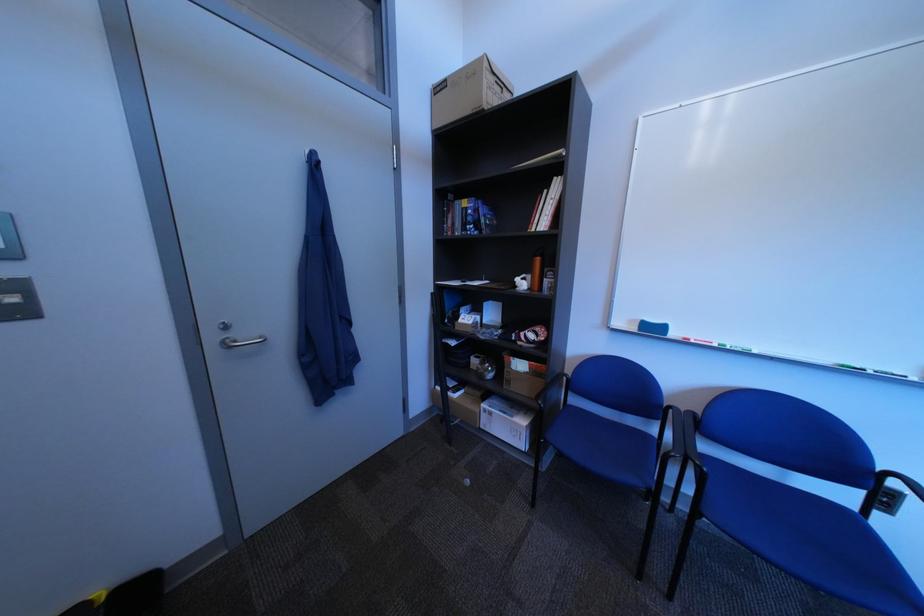
What do you see at coordinates (716, 345) in the screenshot? I see `the whiteboard marker` at bounding box center [716, 345].